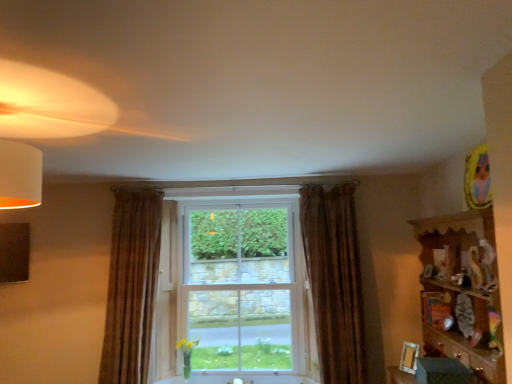
Question: Is wooden shelf at right to the right of brown textured curtain at left, arranged as the 1th curtain when viewed from the left, from the viewer's perspective?

Choices:
 (A) yes
 (B) no

Answer: (A)

Question: Considering the relative sizes of wooden shelf at right and brown textured curtain at left, arranged as the 1th curtain when viewed from the left, in the image provided, is wooden shelf at right wider than brown textured curtain at left, arranged as the 1th curtain when viewed from the left,?

Choices:
 (A) yes
 (B) no

Answer: (A)

Question: Is wooden shelf at right next to brown textured curtain at left, which is the second curtain from right to left?

Choices:
 (A) no
 (B) yes

Answer: (A)

Question: Is wooden shelf at right positioned before brown textured curtain at left, arranged as the 1th curtain when viewed from the left?

Choices:
 (A) yes
 (B) no

Answer: (A)

Question: From the image's perspective, is wooden shelf at right beneath brown textured curtain at left, which is the second curtain from right to left?

Choices:
 (A) yes
 (B) no

Answer: (B)

Question: In the image, is brown velvet curtain at center, arranged as the 2th curtain when viewed from the left, on the left side or the right side of brown textured curtain at left, arranged as the 1th curtain when viewed from the left?

Choices:
 (A) left
 (B) right

Answer: (B)

Question: Is point (333, 218) positioned closer to the camera than point (152, 291)?

Choices:
 (A) closer
 (B) farther

Answer: (A)

Question: In terms of height, does brown velvet curtain at center, arranged as the 1th curtain when viewed from the right, look taller or shorter compared to brown textured curtain at left, arranged as the 1th curtain when viewed from the left?

Choices:
 (A) short
 (B) tall

Answer: (B)

Question: In terms of width, does brown velvet curtain at center, arranged as the 1th curtain when viewed from the right, look wider or thinner when compared to brown textured curtain at left, arranged as the 1th curtain when viewed from the left?

Choices:
 (A) wide
 (B) thin

Answer: (A)

Question: Does point [x=220, y=215] appear closer or farther from the camera than point [x=439, y=291]?

Choices:
 (A) closer
 (B) farther

Answer: (B)

Question: From a real-world perspective, is clear glass window at center physically located above or below wooden shelf at right?

Choices:
 (A) below
 (B) above

Answer: (B)

Question: In the image, is clear glass window at center positioned in front of or behind wooden shelf at right?

Choices:
 (A) behind
 (B) front

Answer: (A)

Question: Based on their sizes in the image, would you say clear glass window at center is bigger or smaller than wooden shelf at right?

Choices:
 (A) small
 (B) big

Answer: (A)

Question: Is brown textured curtain at left, arranged as the 1th curtain when viewed from the left, bigger or smaller than wooden picture frame at lower right?

Choices:
 (A) big
 (B) small

Answer: (A)

Question: From the image's perspective, is brown textured curtain at left, arranged as the 1th curtain when viewed from the left, located above or below wooden picture frame at lower right?

Choices:
 (A) above
 (B) below

Answer: (A)